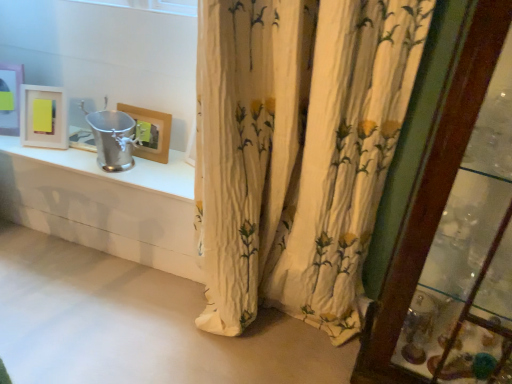
This screenshot has width=512, height=384. In order to click on vacant space positioned to the left of white floral fabric curtain at center in this screenshot , I will do `click(139, 326)`.